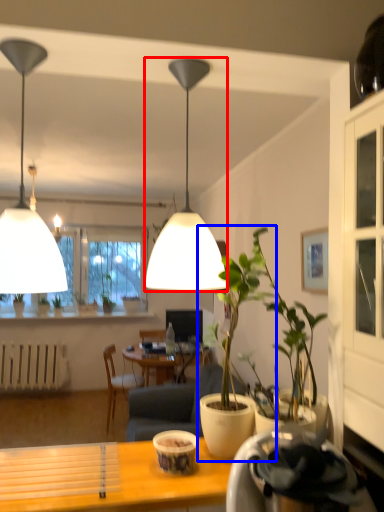
Question: Which object appears closest to the camera in this image, lamp (highlighted by a red box) or houseplant (highlighted by a blue box)?

Choices:
 (A) lamp
 (B) houseplant

Answer: (B)